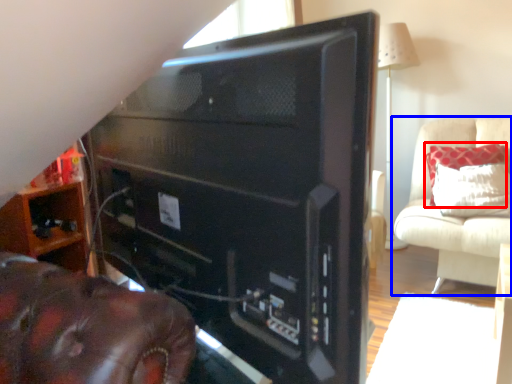
Question: Among these objects, which one is farthest to the camera, pillow (highlighted by a red box) or furniture (highlighted by a blue box)?

Choices:
 (A) pillow
 (B) furniture

Answer: (A)